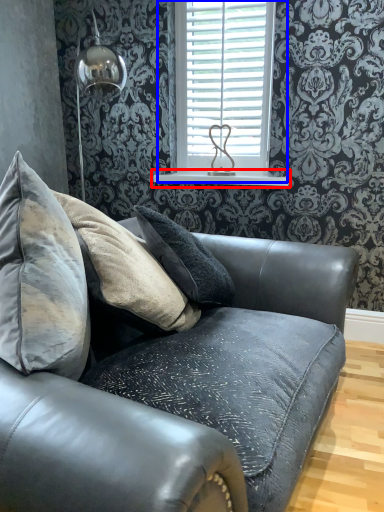
Question: Which object is further to the camera taking this photo, window sill (highlighted by a red box) or window (highlighted by a blue box)?

Choices:
 (A) window sill
 (B) window

Answer: (A)